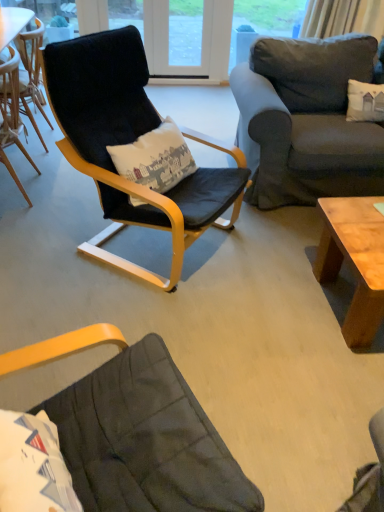
In order to click on free space that is in between velvet black armchair at center, the second chair in the left-to-right sequence, and wooden chair at left, the second chair in the right-to-left sequence in this screenshot , I will do `click(57, 209)`.